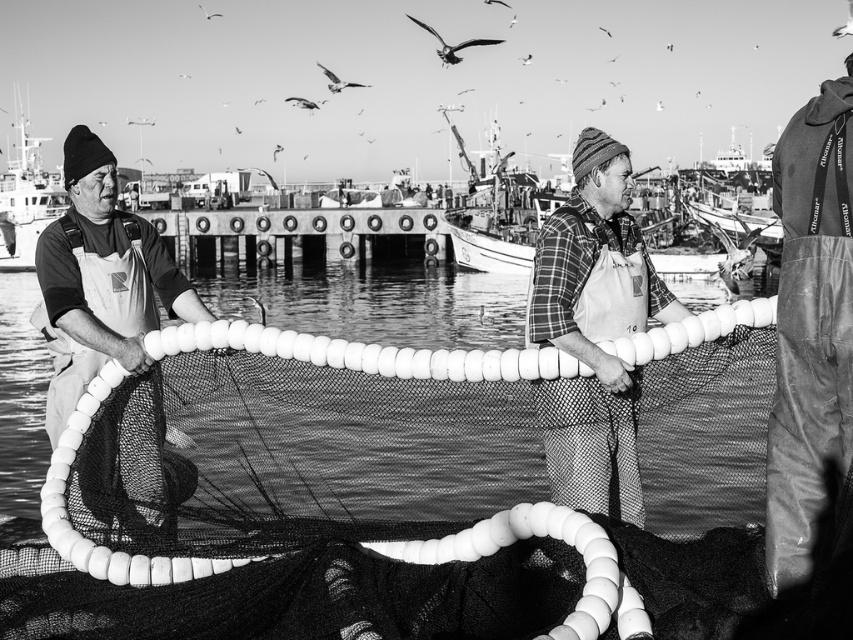
Can you confirm if leather pants at lower right is wider than metallic boat at left?

No, leather pants at lower right is not wider than metallic boat at left.

Who is lower down, leather pants at lower right or metallic boat at left?

leather pants at lower right is lower down.

I want to click on leather pants at lower right, so click(x=810, y=326).

Identify the location of leather pants at lower right. (810, 326).

Is the position of white mesh net at center more distant than that of plaid fabric shirt at center?

No, it is in front of plaid fabric shirt at center.

How much distance is there between white mesh net at center and plaid fabric shirt at center?

They are 7.36 meters apart.

Which is behind, point (643, 582) or point (550, 292)?

The point (550, 292) is behind.

Where is `white mesh net at center`? This screenshot has height=640, width=853. white mesh net at center is located at coordinates (380, 502).

Does white mesh net at center come behind metallic boat at left?

No, it is in front of metallic boat at left.

Is point (91, 420) positioned in front of point (25, 129)?

Yes, point (91, 420) is closer to viewer.

This screenshot has height=640, width=853. What are the coordinates of `white mesh net at center` in the screenshot? It's located at (380, 502).